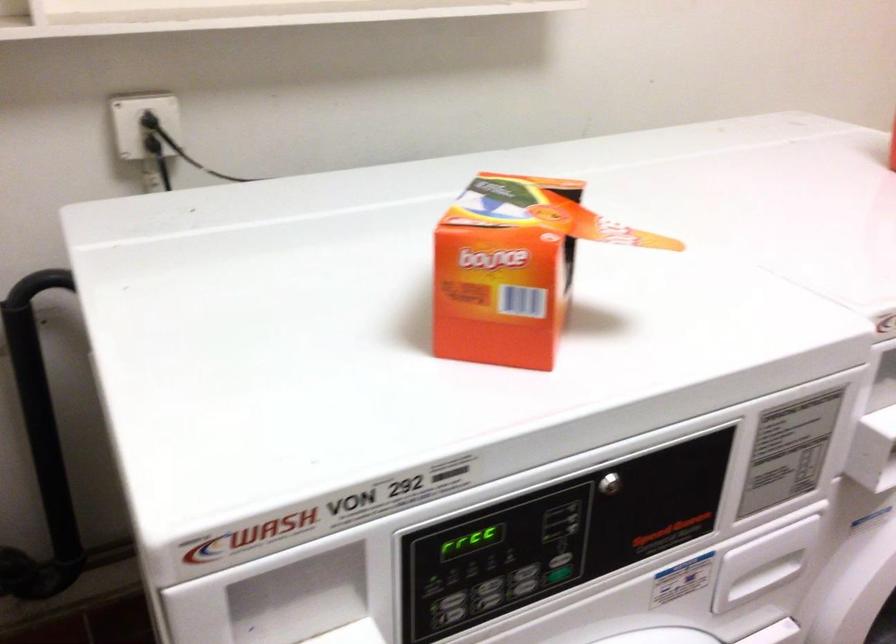
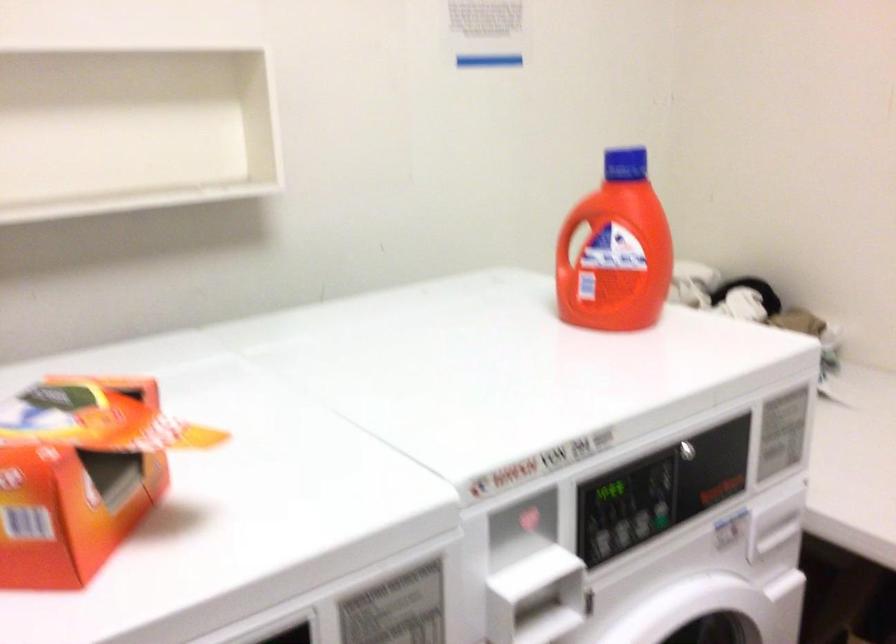
Question: The images are taken continuously from a first-person perspective. In which direction is your viewpoint rotating?

Choices:
 (A) Left
 (B) Right
 (C) Up
 (D) Down

Answer: (B)